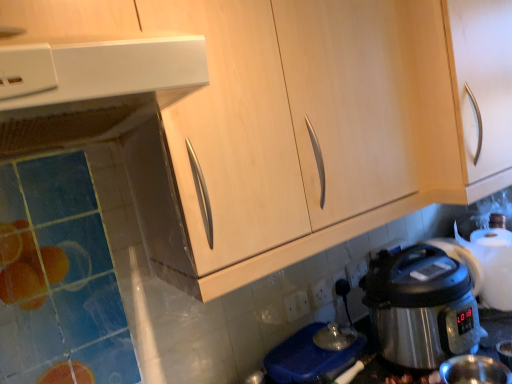
In order to face shiny metallic coffee cup at lower right, should I rotate leftwards or rightwards?

You should look right and rotate roughly 28.018 degrees.

Image resolution: width=512 pixels, height=384 pixels. Find the location of `light wood cabinet at upper right`. light wood cabinet at upper right is located at coordinates (368, 101).

The width and height of the screenshot is (512, 384). I want to click on white plastic electric outlet at lower center, arranged as the 2th electric outlet when viewed from the right, so click(322, 291).

Describe the element at coordinates (356, 271) in the screenshot. I see `white plastic power plugs and sockets at lower center` at that location.

The height and width of the screenshot is (384, 512). I want to click on black plastic electric outlet at lower center, the second electric outlet when ordered from left to right, so click(340, 284).

Looking at this image, considering the positions of objects white plastic power outlet at lower center and stainless steel rice cooker at lower right in the image provided, who is more to the left, white plastic power outlet at lower center or stainless steel rice cooker at lower right?

white plastic power outlet at lower center.

From a real-world perspective, is white plastic power outlet at lower center on top of stainless steel rice cooker at lower right?

No, from a real-world perspective, white plastic power outlet at lower center is not above stainless steel rice cooker at lower right.

You are a GUI agent. You are given a task and a screenshot of the screen. Output one action in this format:
    pyautogui.click(x=<x>, y=<y>)
    Task: Click on the power outlet that is under the stainless steel rice cooker at lower right (from a real-world perspective)
    
    Given the screenshot: What is the action you would take?
    pyautogui.click(x=296, y=305)

Is white plastic electric outlet at lower center, positioned as the first electric outlet in left-to-right order, in contact with stainless steel rice cooker at lower right?

No, white plastic electric outlet at lower center, positioned as the first electric outlet in left-to-right order, is not beside stainless steel rice cooker at lower right.

Choose the correct answer: Is white plastic electric outlet at lower center, arranged as the 2th electric outlet when viewed from the right, inside stainless steel rice cooker at lower right or outside it?

white plastic electric outlet at lower center, arranged as the 2th electric outlet when viewed from the right, is not inside stainless steel rice cooker at lower right, it's outside.

Is shiny metallic coffee cup at lower right outside of white plastic electric outlet at lower center, arranged as the 2th electric outlet when viewed from the right?

That's correct, shiny metallic coffee cup at lower right is outside of white plastic electric outlet at lower center, arranged as the 2th electric outlet when viewed from the right.

How different are the orientations of shiny metallic coffee cup at lower right and white plastic electric outlet at lower center, arranged as the 2th electric outlet when viewed from the right, in degrees?

The angular difference between shiny metallic coffee cup at lower right and white plastic electric outlet at lower center, arranged as the 2th electric outlet when viewed from the right, is 8.6 degrees.

Between point (500, 381) and point (326, 300), which one is positioned behind?

The point (326, 300) is farther from the camera.

Is shiny metallic coffee cup at lower right in contact with white plastic electric outlet at lower center, positioned as the first electric outlet in left-to-right order?

No, shiny metallic coffee cup at lower right is not touching white plastic electric outlet at lower center, positioned as the first electric outlet in left-to-right order.

How different are the orientations of white plastic power outlet at lower center and light wood cabinet at upper right in degrees?

white plastic power outlet at lower center and light wood cabinet at upper right are facing 2.96 degrees away from each other.

Measure the distance between white plastic power outlet at lower center and light wood cabinet at upper right.

A distance of 24.91 inches exists between white plastic power outlet at lower center and light wood cabinet at upper right.

Considering the sizes of white plastic power outlet at lower center and light wood cabinet at upper right in the image, is white plastic power outlet at lower center taller or shorter than light wood cabinet at upper right?

Considering their sizes, white plastic power outlet at lower center has less height than light wood cabinet at upper right.

Which object is thinner, white plastic power outlet at lower center or light wood cabinet at upper right?

With smaller width is white plastic power outlet at lower center.

Which of these two, stainless steel rice cooker at lower right or light wood cabinet at upper right, is smaller?

Smaller between the two is stainless steel rice cooker at lower right.

Considering the sizes of objects stainless steel rice cooker at lower right and light wood cabinet at upper right in the image provided, who is shorter, stainless steel rice cooker at lower right or light wood cabinet at upper right?

With less height is stainless steel rice cooker at lower right.

Based on the photo, which object is positioned more to the left, stainless steel rice cooker at lower right or light wood cabinet at upper right?

Positioned to the left is stainless steel rice cooker at lower right.

Considering the relative sizes of stainless steel rice cooker at lower right and light wood cabinet at upper right in the image provided, is stainless steel rice cooker at lower right wider than light wood cabinet at upper right?

No.

Measure the distance from light wood cabinet at upper right to stainless steel rice cooker at lower right.

light wood cabinet at upper right is 15.02 inches from stainless steel rice cooker at lower right.

Is light wood cabinet at upper right looking in the opposite direction of stainless steel rice cooker at lower right?

No, light wood cabinet at upper right is not facing the opposite direction of stainless steel rice cooker at lower right.

In terms of height, does light wood cabinet at upper right look taller or shorter compared to stainless steel rice cooker at lower right?

light wood cabinet at upper right is taller than stainless steel rice cooker at lower right.

Is light wood cabinet at upper right outside of stainless steel rice cooker at lower right?

Yes, light wood cabinet at upper right is not within stainless steel rice cooker at lower right.

Which point is more distant from viewer, (365, 266) or (426, 343)?

The point (365, 266) is farther from the camera.

Looking at this image, from a real-world perspective, which object rests below the other?

white plastic power plugs and sockets at lower center.

Is white plastic power plugs and sockets at lower center not within stainless steel rice cooker at lower right?

Yes, white plastic power plugs and sockets at lower center is outside of stainless steel rice cooker at lower right.

Can you confirm if white plastic power plugs and sockets at lower center is positioned to the right of stainless steel rice cooker at lower right?

Incorrect, white plastic power plugs and sockets at lower center is not on the right side of stainless steel rice cooker at lower right.

This screenshot has width=512, height=384. I want to click on power outlet below the stainless steel rice cooker at lower right (from the image's perspective), so click(296, 305).

At what (x,y) coordinates should I click in order to perform the action: click on rice cooker above the white plastic electric outlet at lower center, positioned as the first electric outlet in left-to-right order (from a real-world perspective). Please return your answer as a coordinate pair (x, y). The image size is (512, 384). Looking at the image, I should click on (421, 307).

Based on the photo, considering their positions, is stainless steel rice cooker at lower right positioned further to shiny metallic coffee cup at lower right than white plastic electric outlet at lower center, positioned as the first electric outlet in left-to-right order?

white plastic electric outlet at lower center, positioned as the first electric outlet in left-to-right order.

When comparing their distances from white plastic power plugs and sockets at lower center, does white plastic power outlet at lower center or shiny metallic coffee cup at lower right seem further?

Among the two, shiny metallic coffee cup at lower right is located further to white plastic power plugs and sockets at lower center.

Based on their spatial positions, is white plastic power outlet at lower center or shiny metallic coffee cup at lower right further from light wood cabinet at upper right?

shiny metallic coffee cup at lower right lies further to light wood cabinet at upper right than the other object.

When comparing their distances from white plastic power outlet at lower center, does light wood cabinet at upper right or shiny metallic coffee cup at lower right seem further?

light wood cabinet at upper right is further to white plastic power outlet at lower center.

Which object lies nearer to the anchor point shiny metallic coffee cup at lower right, stainless steel rice cooker at lower right or light wood cabinet at upper right?

The object closer to shiny metallic coffee cup at lower right is stainless steel rice cooker at lower right.

Considering their positions, is black plastic electric outlet at lower center, the first electric outlet when ordered from right to left, positioned closer to white plastic electric outlet at lower center, positioned as the first electric outlet in left-to-right order, than white plastic power outlet at lower center?

Among the two, black plastic electric outlet at lower center, the first electric outlet when ordered from right to left, is located nearer to white plastic electric outlet at lower center, positioned as the first electric outlet in left-to-right order.

Based on their spatial positions, is shiny metallic coffee cup at lower right or stainless steel rice cooker at lower right closer to white plastic power plugs and sockets at lower center?

stainless steel rice cooker at lower right is positioned closer to the anchor white plastic power plugs and sockets at lower center.

From the image, which object appears to be nearer to black plastic electric outlet at lower center, the first electric outlet when ordered from right to left, stainless steel rice cooker at lower right or white plastic power plugs and sockets at lower center?

white plastic power plugs and sockets at lower center is positioned closer to the anchor black plastic electric outlet at lower center, the first electric outlet when ordered from right to left.

The height and width of the screenshot is (384, 512). In order to click on power outlet located between stainless steel rice cooker at lower right and white plastic electric outlet at lower center, arranged as the 2th electric outlet when viewed from the right, in the depth direction in this screenshot , I will do `click(296, 305)`.

Identify the location of rice cooker between light wood cabinet at upper right and shiny metallic coffee cup at lower right in the up-down direction. (421, 307).

Locate an element on the screen. The image size is (512, 384). power outlet between light wood cabinet at upper right and shiny metallic coffee cup at lower right from top to bottom is located at coordinates (296, 305).

Where is `power outlet between shiny metallic coffee cup at lower right and white plastic power plugs and sockets at lower center along the z-axis`? The image size is (512, 384). power outlet between shiny metallic coffee cup at lower right and white plastic power plugs and sockets at lower center along the z-axis is located at coordinates (296, 305).